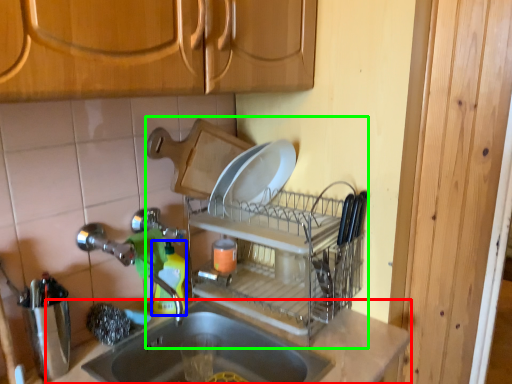
Question: Which is farther away from countertop (highlighted by a red box)? bottle (highlighted by a blue box) or dish washer (highlighted by a green box)?

Choices:
 (A) bottle
 (B) dish washer

Answer: (A)